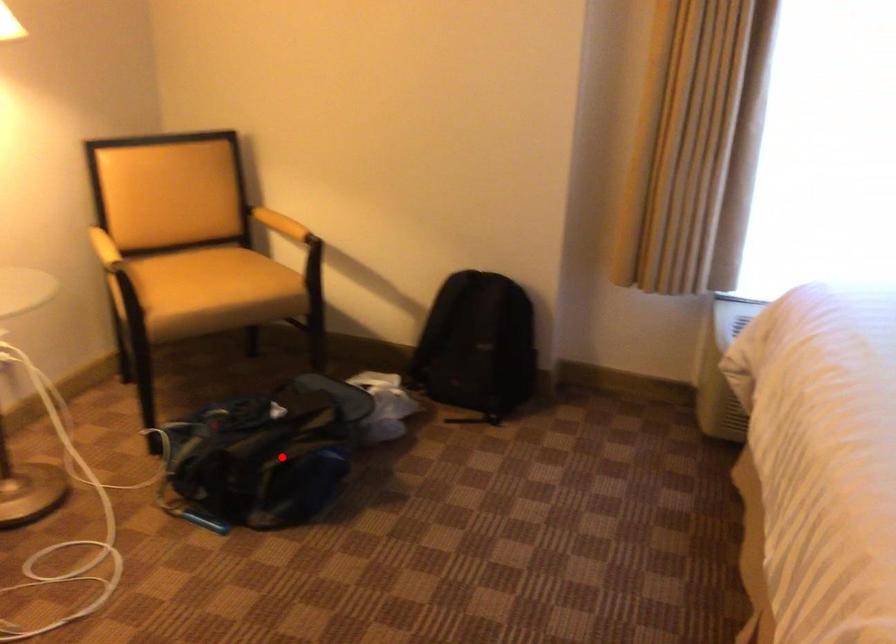
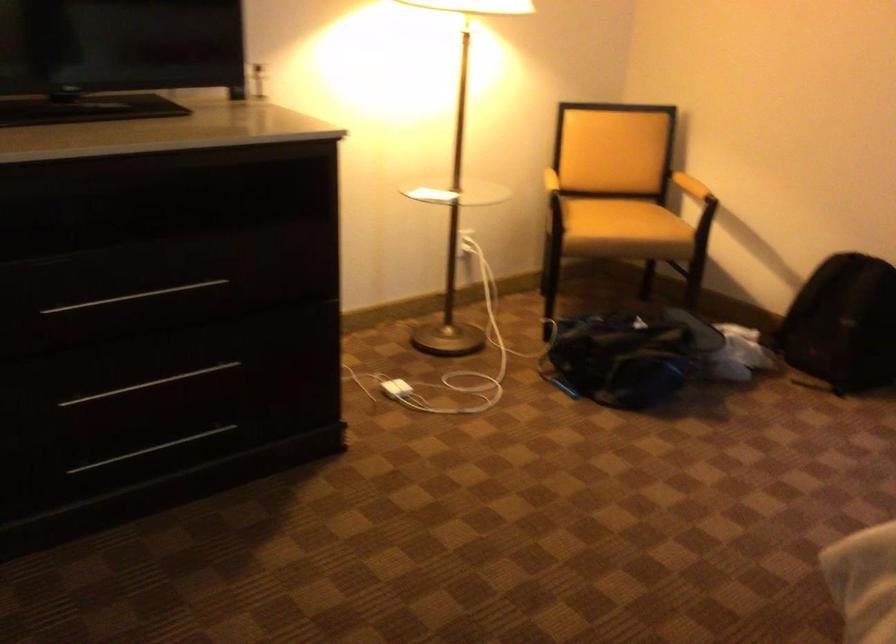
Find the pixel in the second image that matches the highlighted location in the first image.

(627, 355)